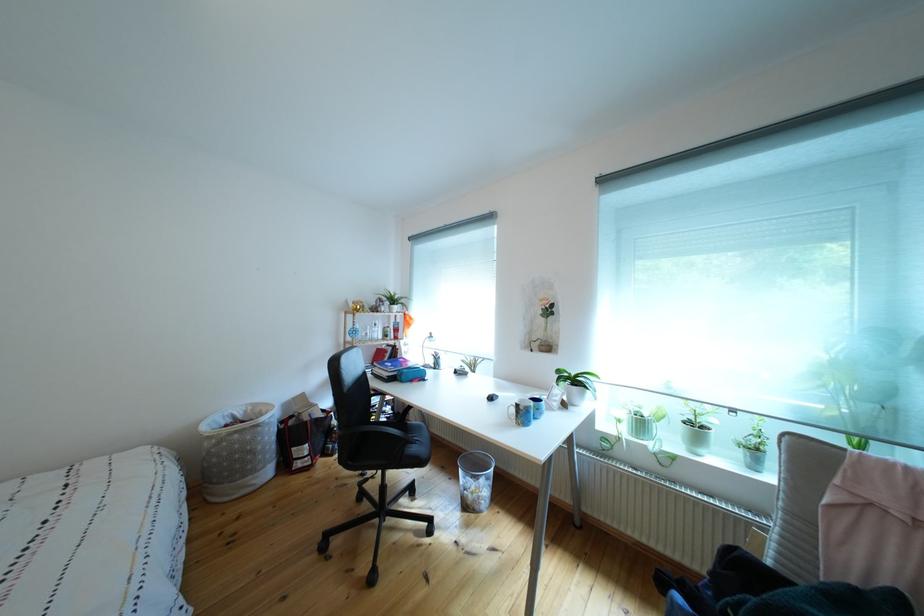
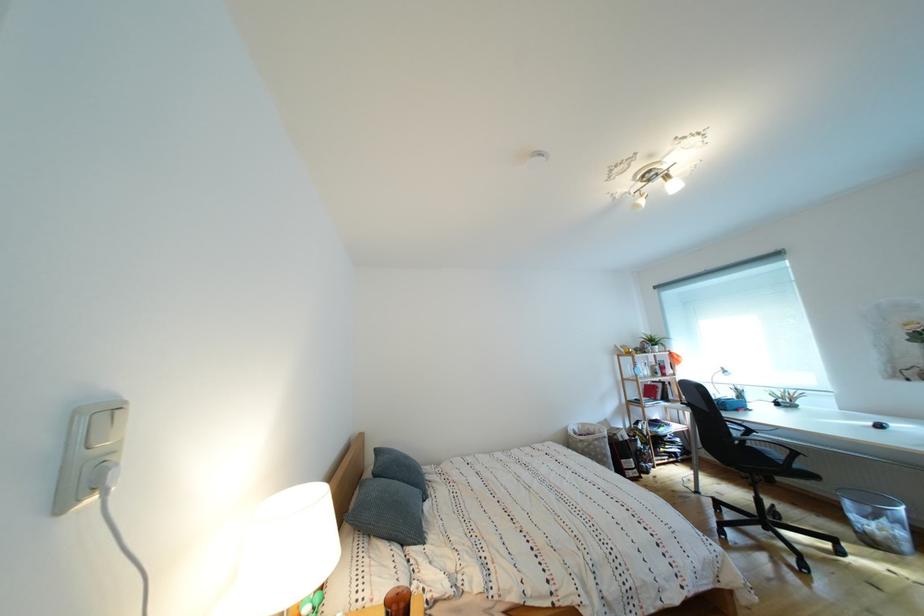
Where in the second image is the point corresponding to point (383, 345) from the first image?

(657, 383)